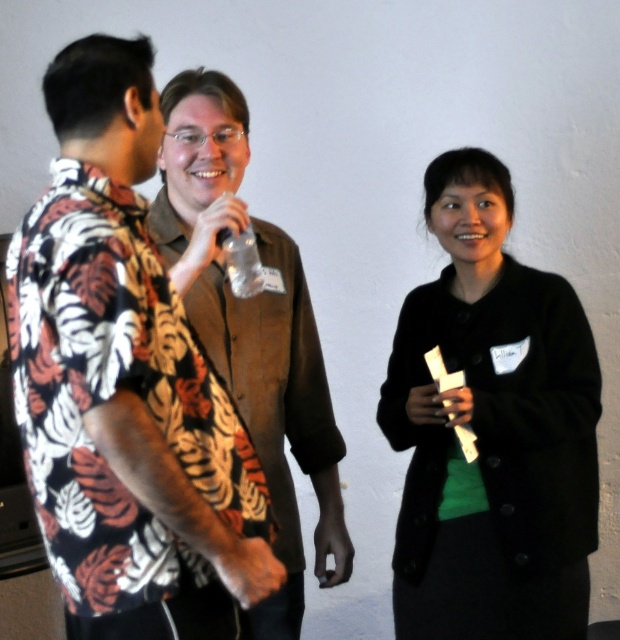
Can you confirm if floral fabric shirt at left is smaller than brown suede shirt at center?

Yes, floral fabric shirt at left is smaller than brown suede shirt at center.

Locate an element on the screen. This screenshot has width=620, height=640. floral fabric shirt at left is located at coordinates coord(125,384).

The image size is (620, 640). Find the location of `floral fabric shirt at left`. floral fabric shirt at left is located at coordinates (125, 384).

Is brown suede shirt at center bigger than clear plastic bottle at center?

Yes, brown suede shirt at center is bigger than clear plastic bottle at center.

Which is behind, point (330, 416) or point (224, 259)?

The point (330, 416) is behind.

Identify the location of brown suede shirt at center. The height and width of the screenshot is (640, 620). (250, 326).

Does black matte blazer at center have a greater width compared to brown suede shirt at center?

Indeed, black matte blazer at center has a greater width compared to brown suede shirt at center.

In the scene shown: Can you confirm if black matte blazer at center is thinner than brown suede shirt at center?

No.

At what (x,y) coordinates should I click in order to perform the action: click on black matte blazer at center. Please return your answer as a coordinate pair (x, y). Image resolution: width=620 pixels, height=640 pixels. Looking at the image, I should click on (492, 429).